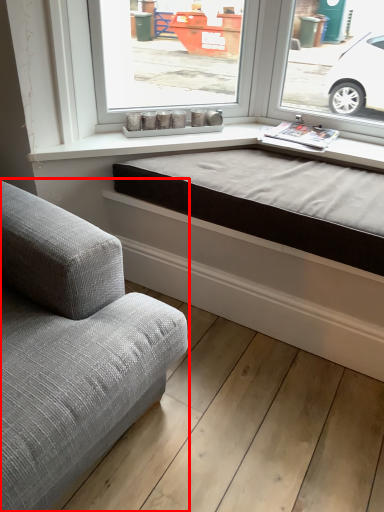
Question: From the image's perspective, what is the correct spatial positioning of studio couch (annotated by the red box) in reference to bed frame?

Choices:
 (A) below
 (B) above

Answer: (A)